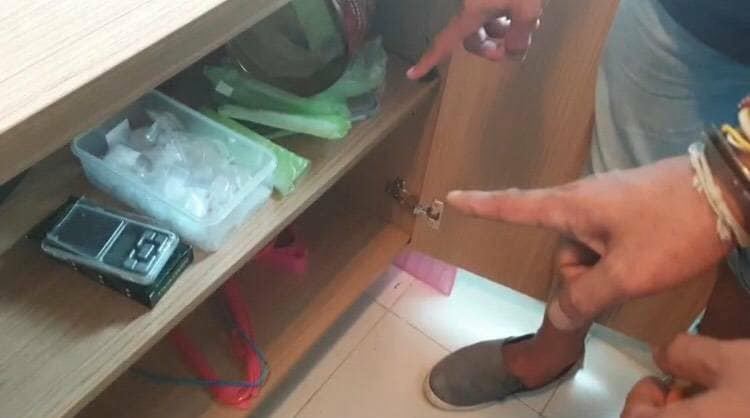
Locate an element on the screen. shelf is located at coordinates (177, 395), (76, 373).